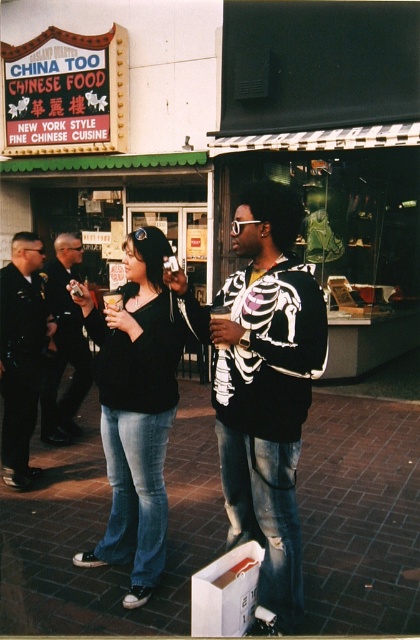
Question: Can you confirm if denim jeans at center is bigger than dark blue uniform at center?

Choices:
 (A) yes
 (B) no

Answer: (A)

Question: Is the position of black matte shirt at center less distant than that of matte black skeleton shirt at center?

Choices:
 (A) no
 (B) yes

Answer: (B)

Question: Which point appears closest to the camera in this image?

Choices:
 (A) (267, 278)
 (B) (13, 380)
 (C) (97, 545)

Answer: (A)

Question: Estimate the real-world distances between objects in this image. Which object is farther from the matte black skeleton shirt at center?

Choices:
 (A) black matte shirt at center
 (B) denim jeans at center

Answer: (B)

Question: Among these objects, which one is nearest to the camera?

Choices:
 (A) denim jeans at center
 (B) dark blue uniform at left

Answer: (A)

Question: Does matte black skeleton shirt at center appear on the left side of denim jeans at center?

Choices:
 (A) yes
 (B) no

Answer: (B)